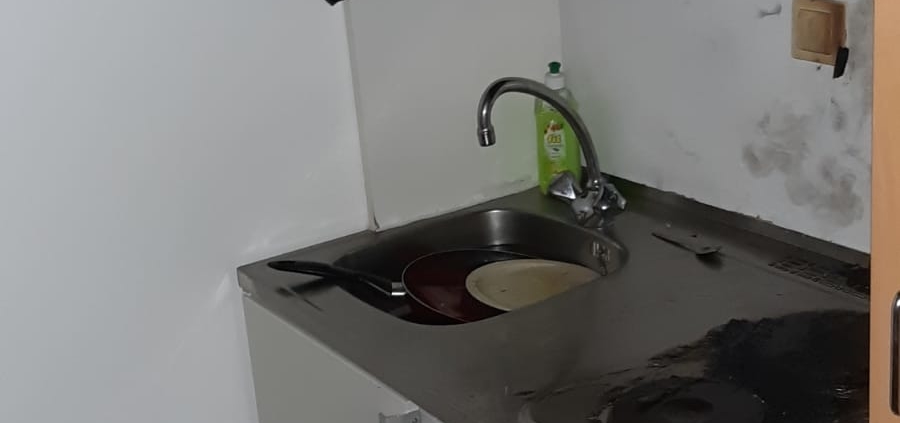
Identify the location of right handle (faucet). The height and width of the screenshot is (423, 900). (610, 195).